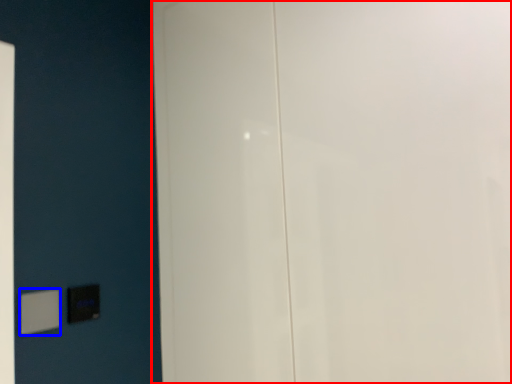
Question: Among these objects, which one is nearest to the camera, door (highlighted by a red box) or light switch (highlighted by a blue box)?

Choices:
 (A) door
 (B) light switch

Answer: (A)